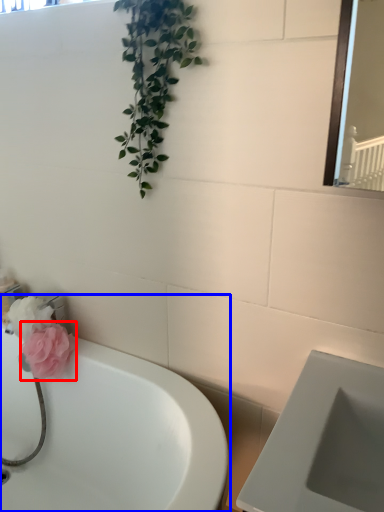
Question: Among these objects, which one is nearest to the camera, flower (highlighted by a red box) or bathtub (highlighted by a blue box)?

Choices:
 (A) flower
 (B) bathtub

Answer: (B)